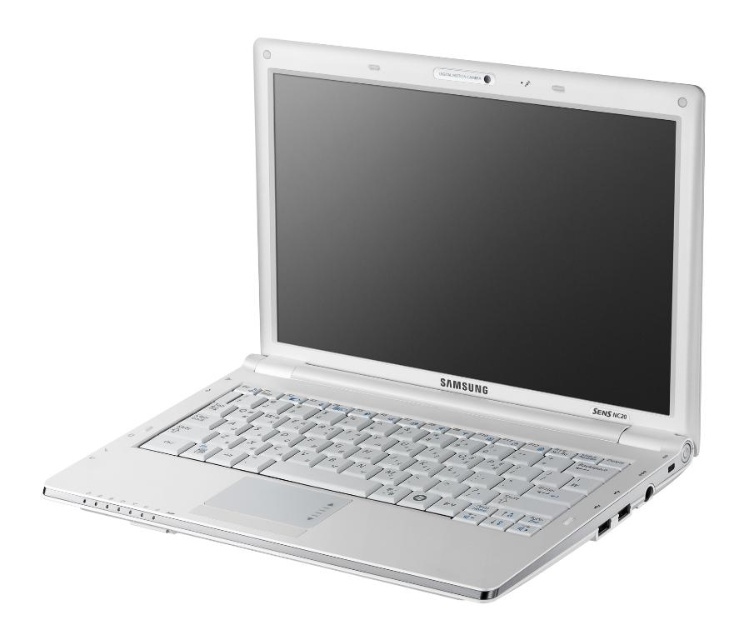
Question: Which object is closer to the camera taking this photo?

Choices:
 (A) satin white screen at center
 (B) white plastic keyboard at center

Answer: (B)

Question: Which object is closer to the camera taking this photo?

Choices:
 (A) white plastic keyboard at center
 (B) satin white screen at center

Answer: (A)

Question: Is satin white screen at center below white plastic keyboard at center?

Choices:
 (A) yes
 (B) no

Answer: (B)

Question: Is satin white screen at center wider than white plastic keyboard at center?

Choices:
 (A) no
 (B) yes

Answer: (A)

Question: Can you confirm if satin white screen at center is positioned to the left of white plastic keyboard at center?

Choices:
 (A) yes
 (B) no

Answer: (B)